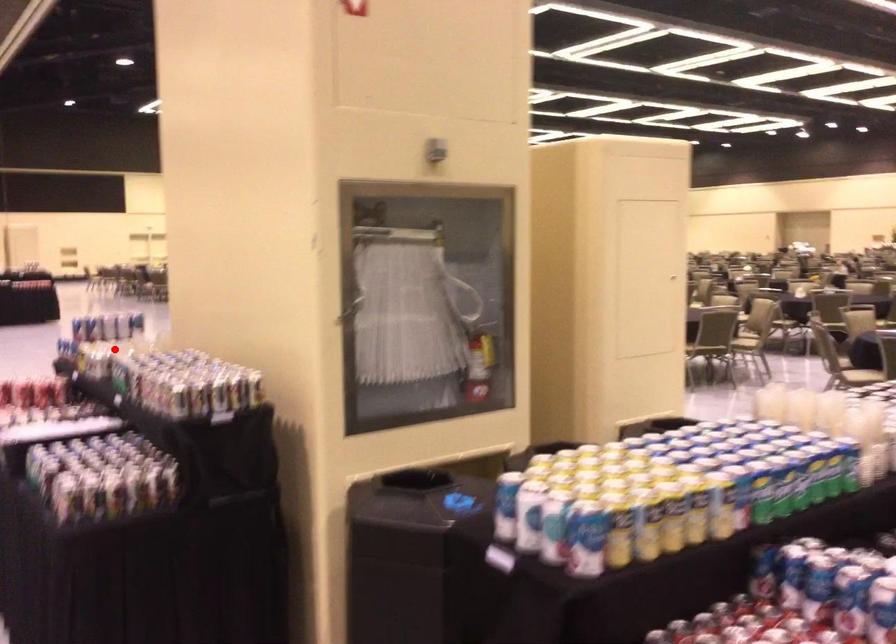
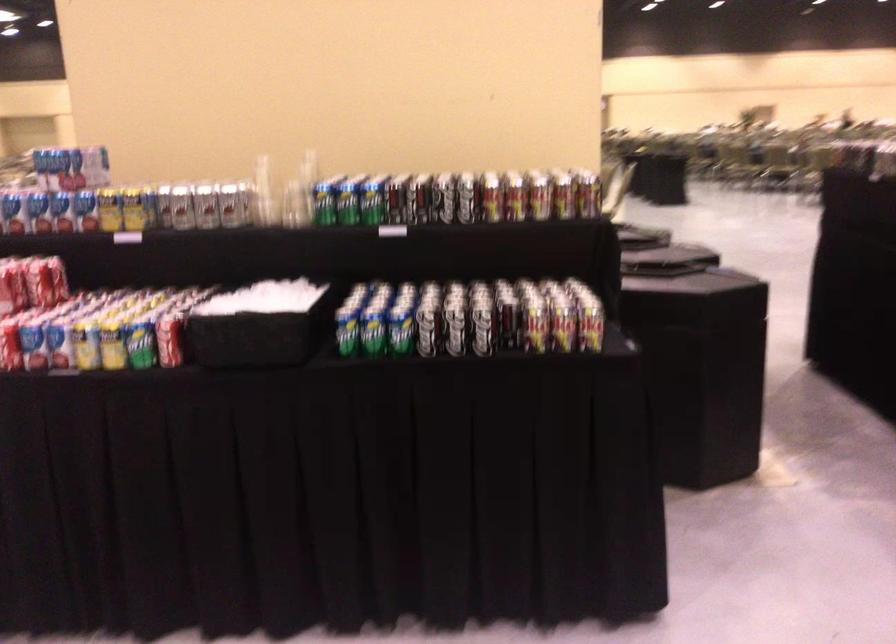
Find the pixel in the second image that matches the highlighted location in the first image.

(228, 205)